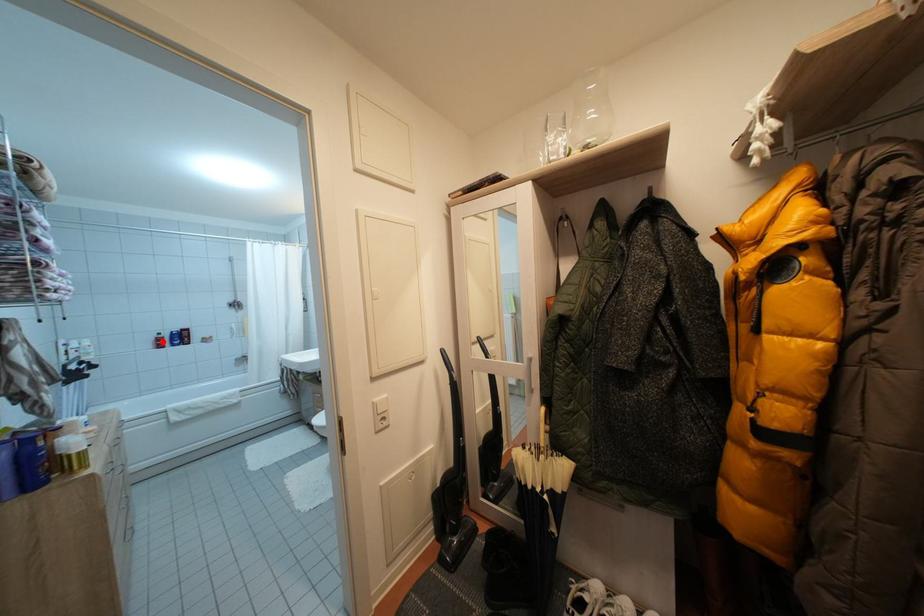
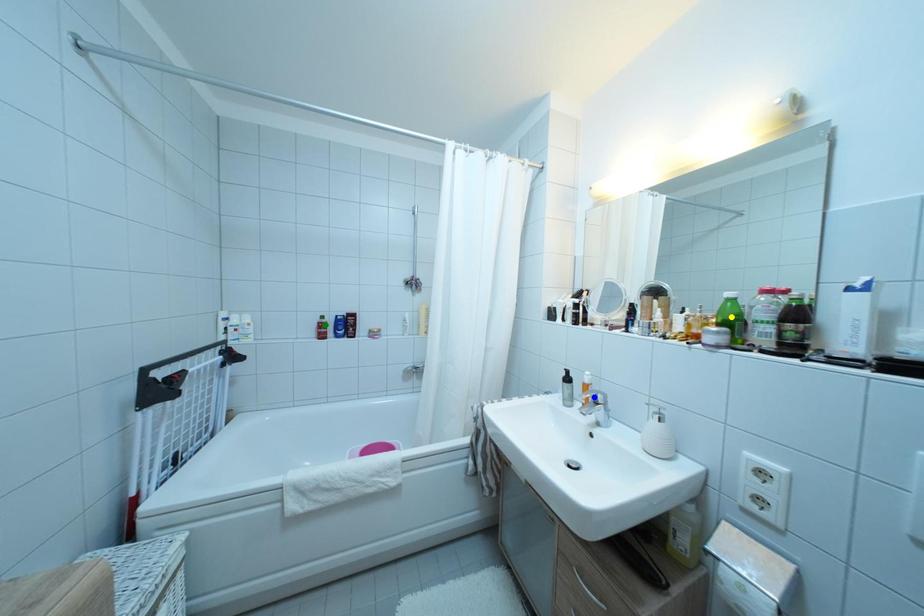
Question: I am providing you with two images of the same scene from different viewpoints. A red point is marked on the first image. You are given multiple points on the second image. In image 2, which mark is for the same physical point as the one in image 1?

Choices:
 (A) green point
 (B) yellow point
 (C) blue point

Answer: (A)